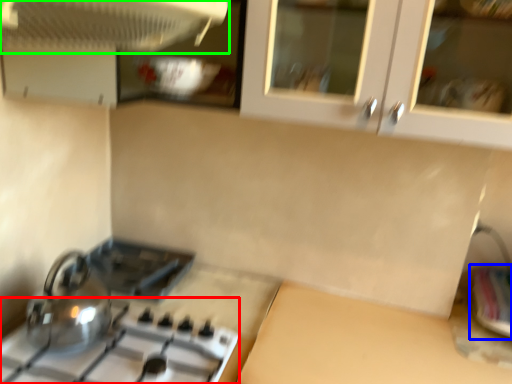
Question: Considering the real-world distances, which object is closest to gas stove (highlighted by a red box)? sink (highlighted by a blue box) or kitchen appliance (highlighted by a green box).

Choices:
 (A) sink
 (B) kitchen appliance

Answer: (B)